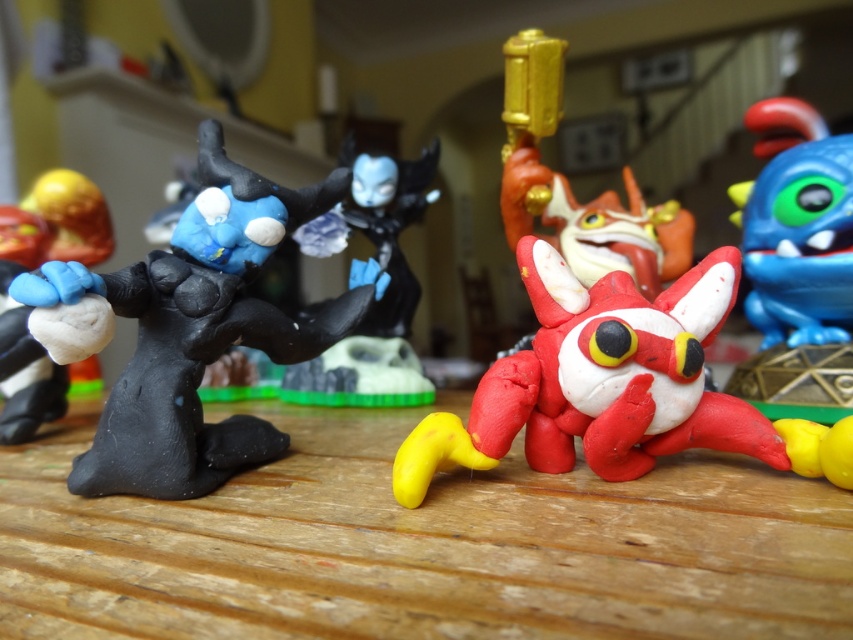
You are a delivery person who needs to place a package on the wooden table at center. However, there is a matte black figure at left in the way. Can you place the package on the table without moving the figure?

The wooden table at center is shorter than the matte black figure at left, so the figure is taller than the table. This means the figure might block access to the table, making it difficult to place the package without moving it.

You are standing in front of the wooden surface with the clay figurines. You want to place a small vase that is 12 inches tall on the surface. The point where you want to place it is at coordinates point (337, 173). Given that the distance from this point to the camera is 38.88 inches, will the vase be visible from your current position?

The distance from point (337, 173) to the camera is 38.88 inches. Since the vase is only 12 inches tall, it will be visible from your current position as it won not block the view beyond it.